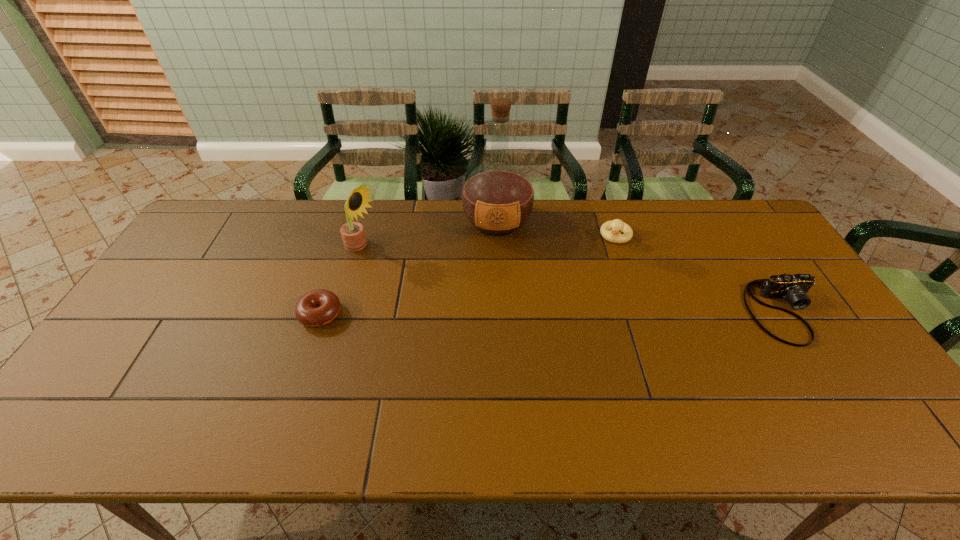
Where is `vacant area that satisfies the following two spatial constraints: 1. on the back side of the doughnut; 2. on the left side of the fourth shortest object`? vacant area that satisfies the following two spatial constraints: 1. on the back side of the doughnut; 2. on the left side of the fourth shortest object is located at coordinates (342, 249).

This screenshot has width=960, height=540. Identify the location of vacant area that satisfies the following two spatial constraints: 1. on the front side of the liquor; 2. on the left side of the second object from right to left. (497, 236).